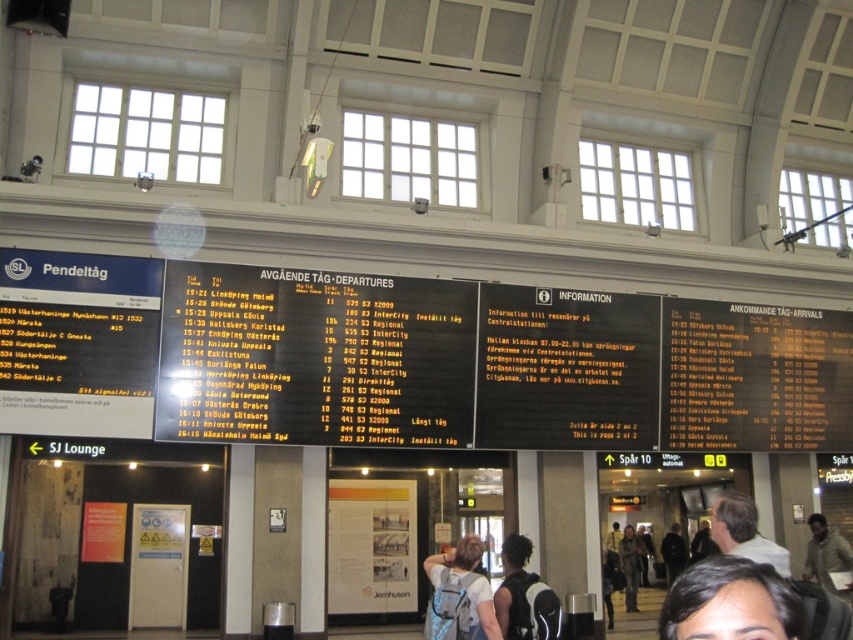
You are standing at the entrance of the train station and want to check the departure times. The black matte departure board at center is located at point [407,360]. If you face the board, which direction should you walk to reach it?

Since the black matte departure board at center is located at point [407,360], you should walk towards the center of the station to reach it.

You are standing in the train station and want to check the departure times for your train. Where should you look to find the black matte departure board at center?

The black matte departure board at center is located at point (407, 360), so you should look there to find the departure times.